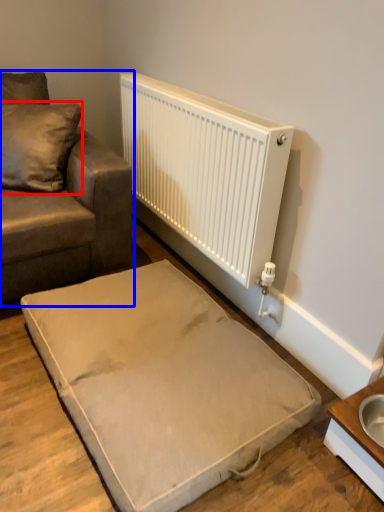
Question: Which object appears closest to the camera in this image, pillow (highlighted by a red box) or studio couch (highlighted by a blue box)?

Choices:
 (A) pillow
 (B) studio couch

Answer: (B)